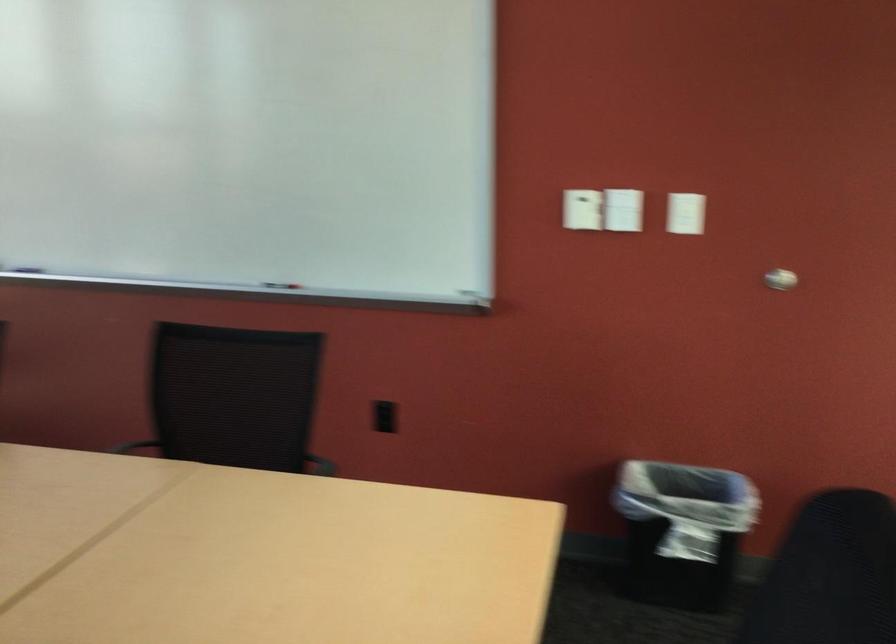
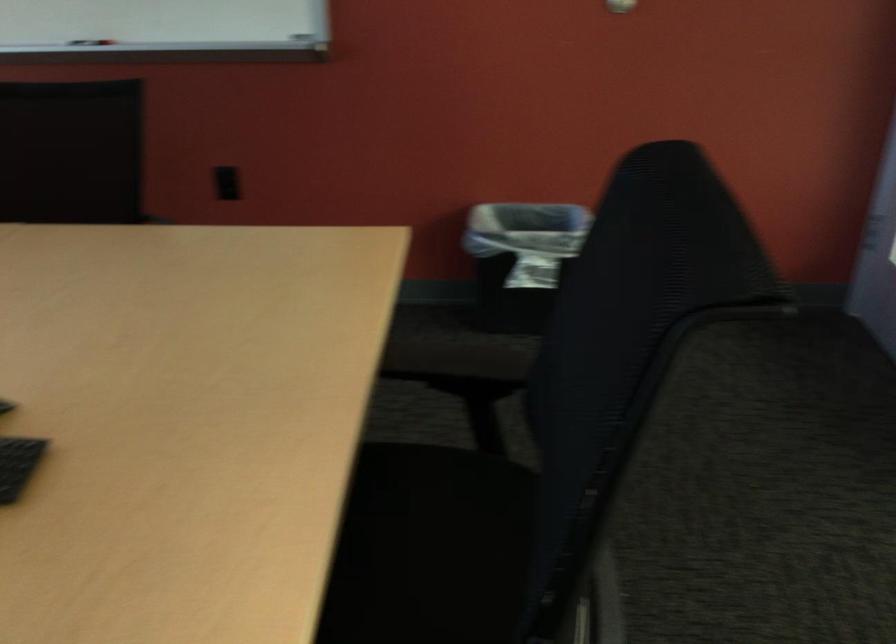
Where in the second image is the point corresponding to (x=686, y=538) from the first image?

(521, 260)